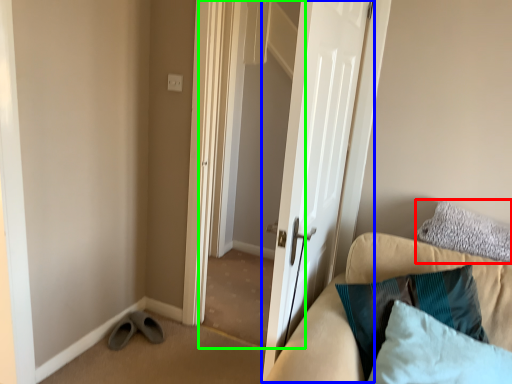
Question: Considering the real-world distances, which object is farthest from pillow (highlighted by a red box)? door (highlighted by a blue box) or screen door (highlighted by a green box)?

Choices:
 (A) door
 (B) screen door

Answer: (B)